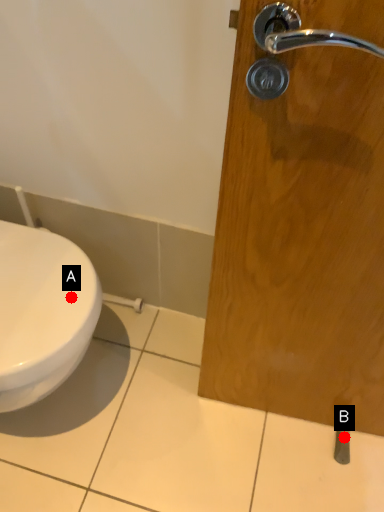
Question: Two points are circled on the image, labeled by A and B beside each circle. Which point appears closest to the camera in this image?

Choices:
 (A) A is closer
 (B) B is closer

Answer: (A)